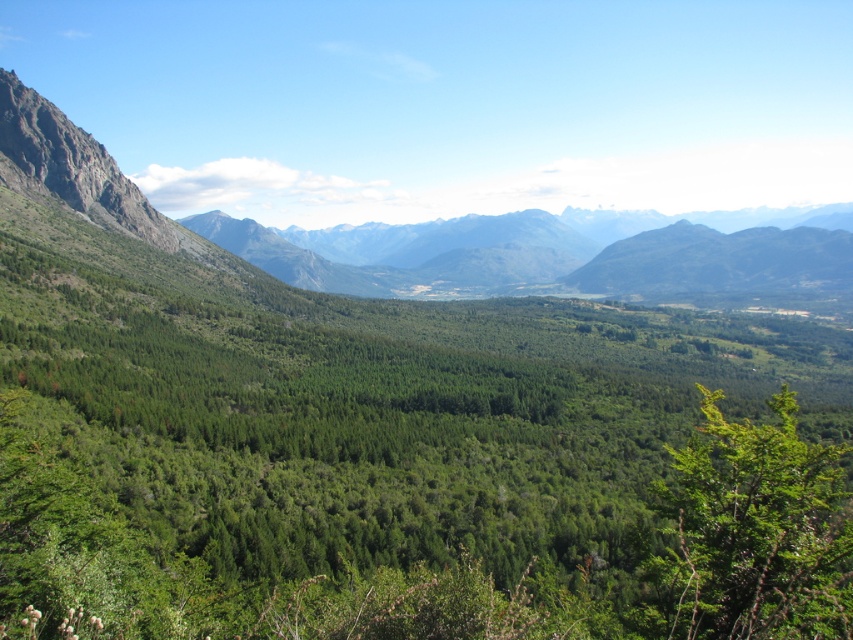
Based on the scene description, where is the green forested mountain located in relation to the point marked at coordinates (549,257)?

The green forested mountain is located at the left side of the image, as indicated by the point marked at coordinates (549,257).

You are planning to set up a hiking trail that requires a path width of 3 meters. Based on the image, can you determine if the space between the green forested mountain at left and the green leafy tree at lower right is sufficient for the trail?

The green forested mountain at left is wider than the green leafy tree at lower right, so the space between them should be sufficient for a 3 meter wide hiking trail.

You are standing at the base of the green forested mountain at left and want to walk to the green leafy tree at lower right. Which direction should you head to reach the tree while avoiding the mountain?

The green leafy tree at lower right is behind the green forested mountain at left, so to reach it without going through the mountain, you should head around the mountain to the right side or left side to find a path around it.